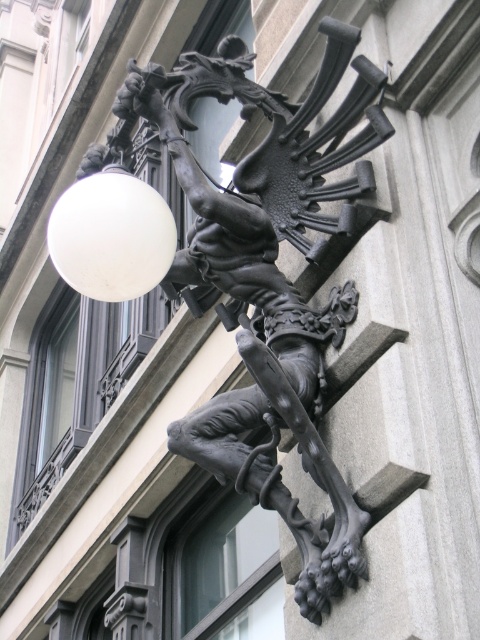
Between point (215, 282) and point (140, 180), which one is positioned behind?

Positioned behind is point (215, 282).

Does black matte sculpture at upper center have a larger size compared to white matte sphere at upper left?

Yes, black matte sculpture at upper center is bigger than white matte sphere at upper left.

Measure the distance between black matte sculpture at upper center and camera.

black matte sculpture at upper center and camera are 12.86 meters apart from each other.

Where is `black matte sculpture at upper center`? The width and height of the screenshot is (480, 640). black matte sculpture at upper center is located at coordinates (241, 268).